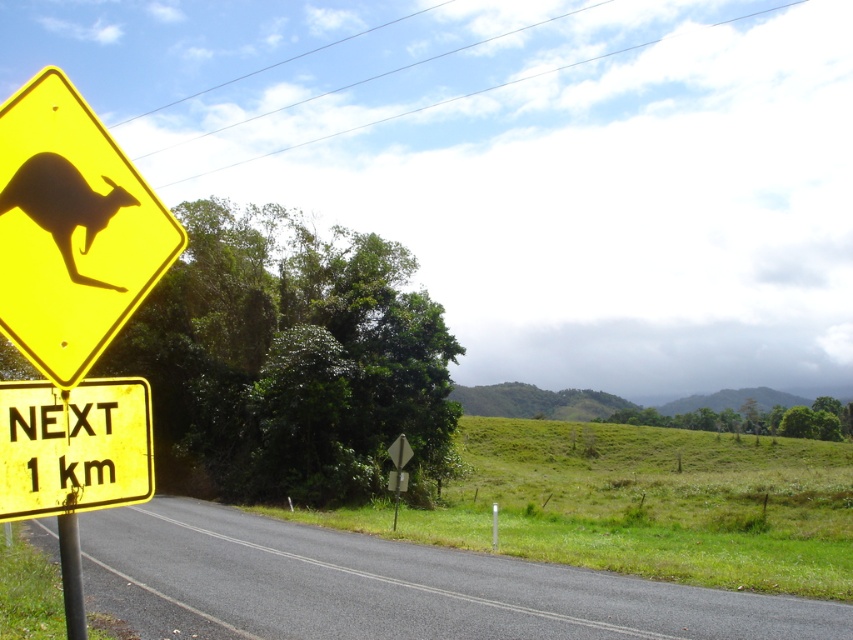
You are a driver approaching the yellow matte sign at lower left on a rural road. The sign indicates a wildlife crossing ahead. If you want to avoid hitting an animal that suddenly appears on the road, which direction should you steer to stay on the road and avoid the obstacle?

The yellow matte sign at lower left is located at point (73, 445), so you should steer to the right to stay on the road and avoid the obstacle.

You are standing at the yellow road sign with the kangaroo silhouette. You see two points in the image, one at point coordinates point [49,227] and another at point coordinates point [83,625]. Which point is closer to you?

Point [49,227] is closer to the viewer than point [83,625].